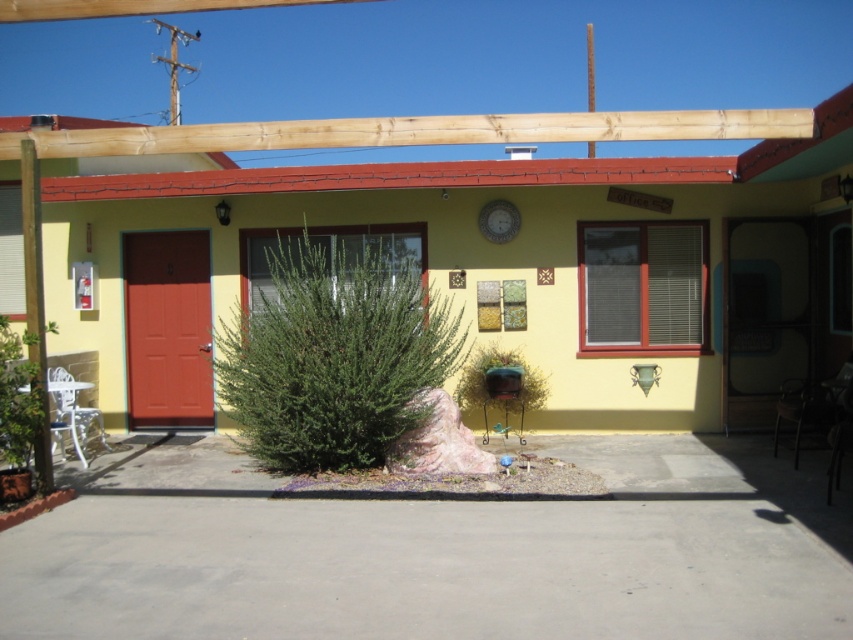
Question: Is green leafy bush at center bigger than green matte bird feeder at lower center?

Choices:
 (A) no
 (B) yes

Answer: (B)

Question: Among these points, which one is farthest from the camera?

Choices:
 (A) (369, 209)
 (B) (349, 381)
 (C) (483, 420)

Answer: (A)

Question: Where is green leafy bush at center located in relation to natural wood beam at upper center in the image?

Choices:
 (A) right
 (B) left

Answer: (B)

Question: Can you confirm if green leafy bush at center is positioned below green matte bird feeder at lower center?

Choices:
 (A) no
 (B) yes

Answer: (A)

Question: Which object appears farthest from the camera in this image?

Choices:
 (A) green leafy plant at lower left
 (B) wooden pergola at upper center

Answer: (B)

Question: Which point appears closest to the camera in this image?

Choices:
 (A) (692, 113)
 (B) (9, 387)
 (C) (595, 291)

Answer: (B)